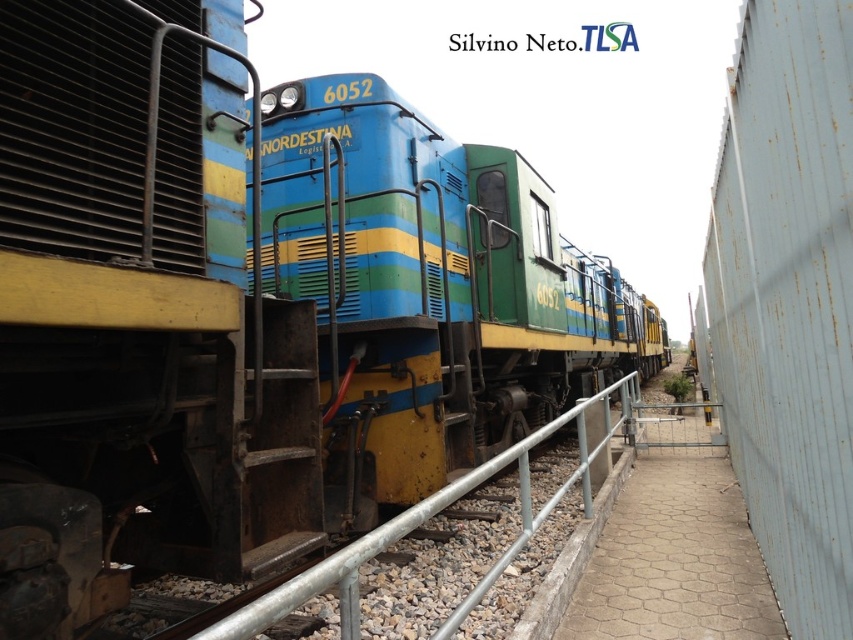
Is rusty metal fence at right to the right of metallic gray rail at center from the viewer's perspective?

Incorrect, rusty metal fence at right is not on the right side of metallic gray rail at center.

Can you confirm if rusty metal fence at right is smaller than metallic gray rail at center?

Yes, rusty metal fence at right is smaller than metallic gray rail at center.

Is point (799, 168) in front of point (587, 451)?

Yes, point (799, 168) is in front of point (587, 451).

At what (x,y) coordinates should I click in order to perform the action: click on rusty metal fence at right. Please return your answer as a coordinate pair (x, y). Looking at the image, I should click on (788, 300).